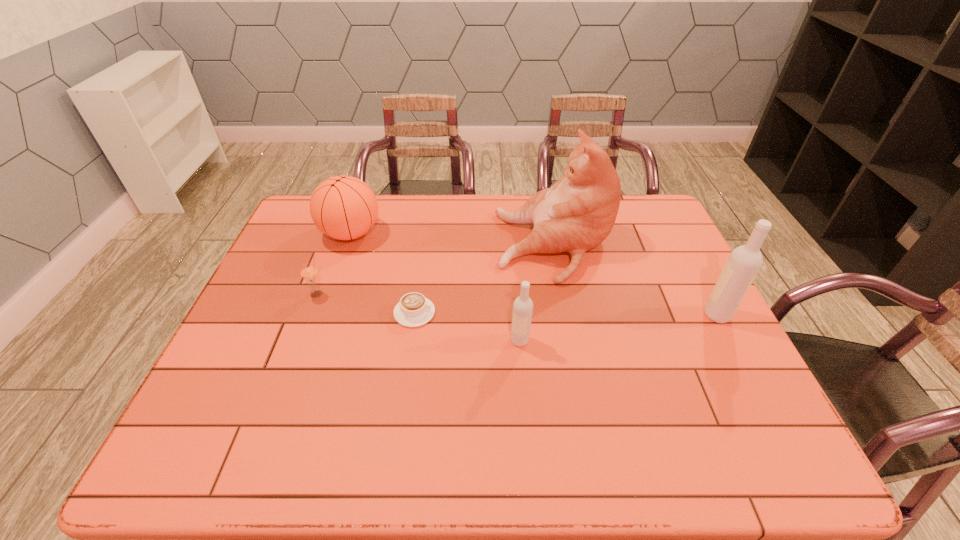
Identify the location of vacant region between the third object from left to right and the fifth tallest object. (366, 303).

Image resolution: width=960 pixels, height=540 pixels. I want to click on empty space that is in between the shortest object and the farther vodka, so click(x=565, y=314).

Find the location of `vacant area between the cat and the shortest object`. vacant area between the cat and the shortest object is located at coordinates (485, 280).

Find the location of `unoccupied area between the basketball and the shortest object`. unoccupied area between the basketball and the shortest object is located at coordinates (383, 273).

Identify the location of empty space that is in between the basketball and the third object from left to right. click(383, 273).

Where is `free space between the shorter vodka and the cat`? The image size is (960, 540). free space between the shorter vodka and the cat is located at coordinates (537, 293).

Locate an element on the screen. The image size is (960, 540). unoccupied position between the third object from left to right and the second shortest object is located at coordinates (366, 303).

Locate an element on the screen. This screenshot has width=960, height=540. object that stands as the third closest to the fourth object from right to left is located at coordinates (309, 273).

Locate which object ranks second in proximity to the shorter vodka. Please provide its 2D coordinates. Your answer should be formatted as a tuple, i.e. [(x, y)], where the tuple contains the x and y coordinates of a point satisfying the conditions above.

[(414, 310)]

Image resolution: width=960 pixels, height=540 pixels. I want to click on free space that satisfies the following two spatial constraints: 1. with the handle on the right side of the second tallest object; 2. on the right side of the cappuccino, so click(x=414, y=315).